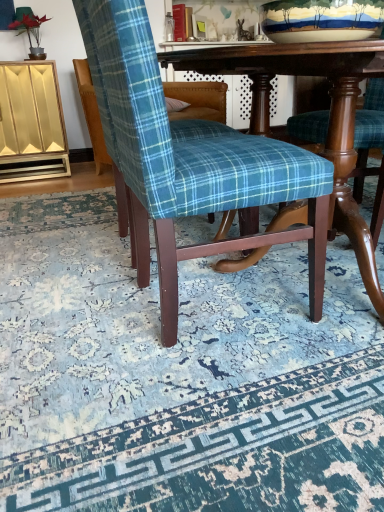
What is the approximate width of blue plaid fabric chair at center?

1.77 meters.

Identify the location of blue plaid fabric chair at center, which is the 2th chair in back-to-front order. (187, 160).

Identify the location of wooden table at center. (330, 115).

This screenshot has height=512, width=384. Find the location of `dresser located behind the earthenware bowl at upper center`. dresser located behind the earthenware bowl at upper center is located at coordinates (31, 123).

Is earthenware bowl at upper center located outside matte gold cabinet at left?

earthenware bowl at upper center is positioned outside matte gold cabinet at left.

Between earthenware bowl at upper center and matte gold cabinet at left, which one has more height?

matte gold cabinet at left is taller.

Considering the positions of points (308, 30) and (61, 119), is point (308, 30) closer to camera compared to point (61, 119)?

Yes.

From a real-world perspective, is wooden table at center above or below matte gold cabinet at left?

wooden table at center is below matte gold cabinet at left.

Which is more to the left, wooden table at center or matte gold cabinet at left?

Positioned to the left is matte gold cabinet at left.

Could you tell me if wooden table at center is facing matte gold cabinet at left?

No.

Is blue plaid fabric chair at center, acting as the 2th chair starting from the front, located outside matte gold cabinet at left?

Absolutely, blue plaid fabric chair at center, acting as the 2th chair starting from the front, is external to matte gold cabinet at left.

Is point (99, 149) positioned in front of point (20, 120)?

No, it is behind (20, 120).

Is blue plaid fabric chair at center, acting as the 2th chair starting from the front, positioned far away from matte gold cabinet at left?

No.

Between blue plaid fabric chair at center, acting as the 2th chair starting from the front, and matte gold cabinet at left, which one has larger width?

blue plaid fabric chair at center, acting as the 2th chair starting from the front, is wider.

From the image's perspective, who appears lower, wooden table at center or earthenware bowl at upper center?

wooden table at center is shown below in the image.

Is wooden table at center far from earthenware bowl at upper center?

No, wooden table at center is in close proximity to earthenware bowl at upper center.

The image size is (384, 512). In order to click on bowl above the wooden table at center (from a real-world perspective) in this screenshot , I will do `click(321, 20)`.

Is wooden table at center completely or partially outside of earthenware bowl at upper center?

That's correct, wooden table at center is outside of earthenware bowl at upper center.

Which object is more forward, wooden table at center or blue plaid fabric chair at center, which is the 2th chair in back-to-front order?

Positioned in front is wooden table at center.

Is wooden table at center directly adjacent to blue plaid fabric chair at center, which is the 2th chair in back-to-front order?

No, wooden table at center is not in contact with blue plaid fabric chair at center, which is the 2th chair in back-to-front order.

From a real-world perspective, relative to wooden table at center, is blue plaid fabric chair at center, placed as the first chair when sorted from back to front, vertically above or below?

From a real-world perspective, blue plaid fabric chair at center, placed as the first chair when sorted from back to front, is physically above wooden table at center.

Who is taller, blue plaid fabric chair at center, acting as the 2th chair starting from the front, or wooden table at center?

blue plaid fabric chair at center, acting as the 2th chair starting from the front.

Looking at this image, would you consider blue plaid fabric chair at center, placed as the first chair when sorted from back to front, to be distant from wooden table at center?

Absolutely, blue plaid fabric chair at center, placed as the first chair when sorted from back to front, is distant from wooden table at center.

Which is more to the left, earthenware bowl at upper center or blue plaid fabric chair at center, the first chair positioned from the front?

From the viewer's perspective, blue plaid fabric chair at center, the first chair positioned from the front, appears more on the left side.

From a real-world perspective, is earthenware bowl at upper center on blue plaid fabric chair at center, which is the 2th chair in back-to-front order?

Yes.

Is earthenware bowl at upper center not near blue plaid fabric chair at center, the first chair positioned from the front?

No, earthenware bowl at upper center is in close proximity to blue plaid fabric chair at center, the first chair positioned from the front.

Locate an element on the screen. This screenshot has height=512, width=384. bowl in front of the matte gold cabinet at left is located at coordinates (321, 20).

Where is `table below the matte gold cabinet at left (from the image's perspective)`? table below the matte gold cabinet at left (from the image's perspective) is located at coordinates (330, 115).

Which object lies further to the anchor point blue plaid fabric chair at center, which is the 2th chair in back-to-front order, blue plaid fabric chair at center, placed as the first chair when sorted from back to front, or blue plaid fabric chair at center?

blue plaid fabric chair at center, placed as the first chair when sorted from back to front, is further to blue plaid fabric chair at center, which is the 2th chair in back-to-front order.

When comparing their distances from blue plaid fabric chair at center, does earthenware bowl at upper center or wooden table at center seem further?

Based on the image, earthenware bowl at upper center appears to be further to blue plaid fabric chair at center.

Looking at the image, which one is located further to wooden table at center, blue plaid fabric chair at center or matte gold cabinet at left?

Among the two, matte gold cabinet at left is located further to wooden table at center.

From the picture: Based on their spatial positions, is blue plaid fabric chair at center or blue plaid fabric chair at center, acting as the 2th chair starting from the front, closer to matte gold cabinet at left?

Based on the image, blue plaid fabric chair at center, acting as the 2th chair starting from the front, appears to be nearer to matte gold cabinet at left.

Based on their spatial positions, is blue plaid fabric chair at center, which is the 2th chair in back-to-front order, or blue plaid fabric chair at center further from earthenware bowl at upper center?

Among the two, blue plaid fabric chair at center is located further to earthenware bowl at upper center.

From the image, which object appears to be farther from blue plaid fabric chair at center, acting as the 2th chair starting from the front, blue plaid fabric chair at center or earthenware bowl at upper center?

Based on the image, blue plaid fabric chair at center appears to be further to blue plaid fabric chair at center, acting as the 2th chair starting from the front.

Considering their positions, is blue plaid fabric chair at center positioned closer to blue plaid fabric chair at center, the first chair positioned from the front, than wooden table at center?

wooden table at center lies closer to blue plaid fabric chair at center, the first chair positioned from the front, than the other object.

When comparing their distances from blue plaid fabric chair at center, does wooden table at center or blue plaid fabric chair at center, the first chair positioned from the front, seem further?

wooden table at center is further to blue plaid fabric chair at center.

Find the location of a particular element. chair between blue plaid fabric chair at center, placed as the first chair when sorted from back to front, and earthenware bowl at upper center from left to right is located at coordinates point(187,160).

Where is `chair between blue plaid fabric chair at center, the first chair positioned from the front, and matte gold cabinet at left in the front-back direction`? The height and width of the screenshot is (512, 384). chair between blue plaid fabric chair at center, the first chair positioned from the front, and matte gold cabinet at left in the front-back direction is located at coordinates (198, 100).

Image resolution: width=384 pixels, height=512 pixels. What are the coordinates of `bowl located between blue plaid fabric chair at center and blue plaid fabric chair at center, acting as the 2th chair starting from the front, in the depth direction` in the screenshot? It's located at (321, 20).

Where is `bowl positioned between blue plaid fabric chair at center, the first chair positioned from the front, and matte gold cabinet at left from near to far`? The image size is (384, 512). bowl positioned between blue plaid fabric chair at center, the first chair positioned from the front, and matte gold cabinet at left from near to far is located at coordinates (321, 20).